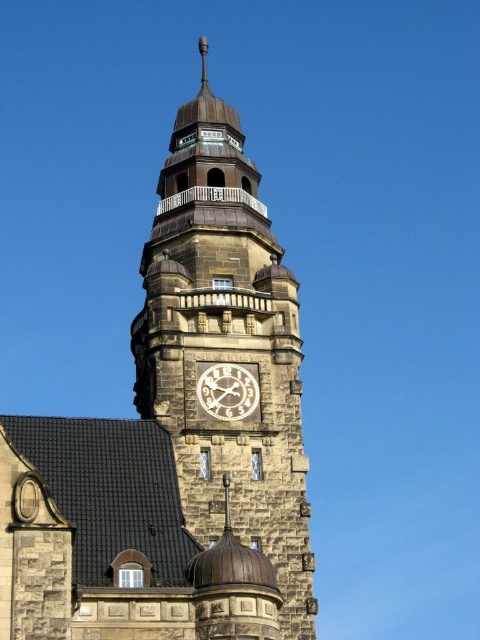
You are standing at the entrance of the historic building and want to locate the stone clock tower at center. According to the coordinates provided, in which direction should you look to find it?

The stone clock tower at center is located at coordinates point (x=176, y=436), which means it is positioned to the upper right of your current position. You should look towards the upper right direction to find it.

You are an architect examining the historic building. You notice the stone clock tower at center and the white wooden clock at center. Which structure has a larger physical size?

The stone clock tower at center is bigger than the white wooden clock at center.

You are standing in front of the historic building and want to take a photo of both the stone clock tower at center and the white wooden clock at center. Which one should you focus on first if you want to ensure both are in the frame?

You should focus on the white wooden clock at center first because the stone clock tower at center is above it, so adjusting the camera to include the lower white wooden clock will naturally include the upper stone clock tower at center in the frame.